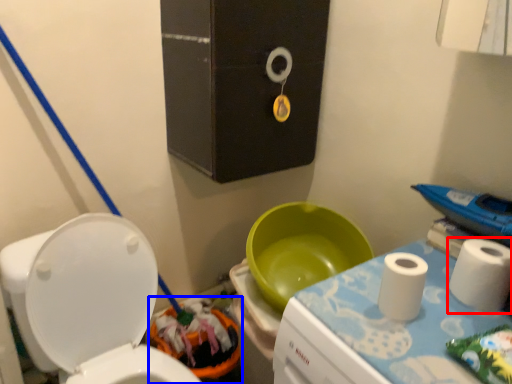
Question: Which object is further to the camera taking this photo, toiletry (highlighted by a red box) or potty (highlighted by a blue box)?

Choices:
 (A) toiletry
 (B) potty

Answer: (B)